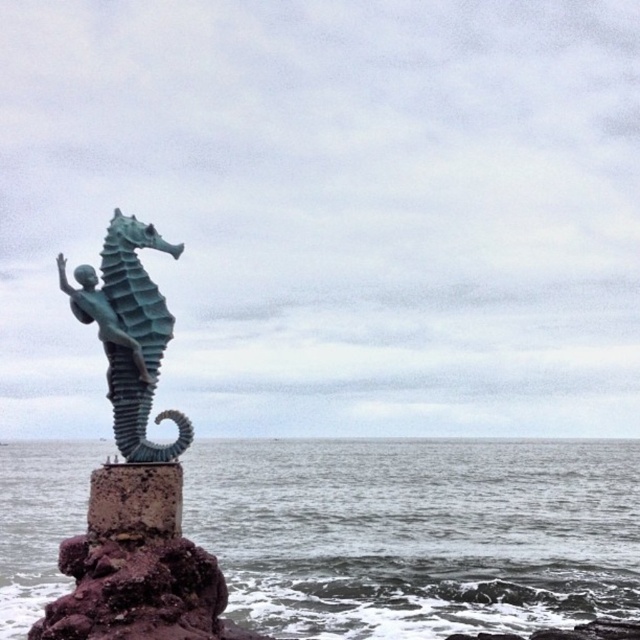
You are a photographer trying to capture the sculpture and the sea in one shot. Since you want the green patina seahorse at center to be the main focus, should you position yourself to the left or right of the sculpture to ensure the gray water at sea left is not blocking the view?

You should position yourself to the right of the sculpture. Since the gray water at sea left is to the right of the green patina seahorse at center, positioning yourself to the right would place the water behind or beside the sculpture, keeping the seahorse as the main focus without obstruction.

You are standing on the beach and see the sculpture. Which object, the gray water at sea left or the green patina seahorse at center, is higher in the image?

The gray water at sea left is taller than the green patina seahorse at center.